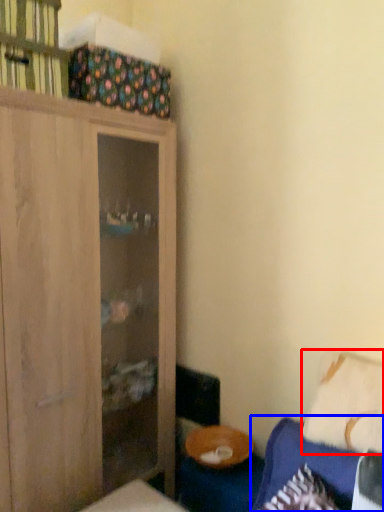
Question: Which object appears farthest to the camera in this image, pillow (highlighted by a red box) or couch (highlighted by a blue box)?

Choices:
 (A) pillow
 (B) couch

Answer: (A)